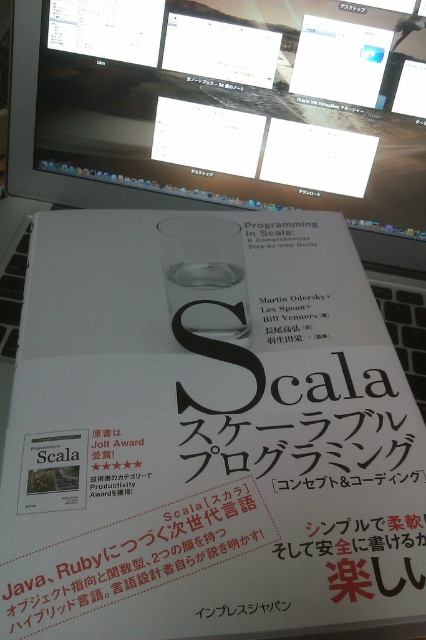
Is transparent glass cup at center smaller than black plastic keyboard at lower left?

Correct, transparent glass cup at center occupies less space than black plastic keyboard at lower left.

Which is in front, point (226, 282) or point (14, 356)?

Positioned in front is point (226, 282).

Find the location of a particular element. This screenshot has height=640, width=426. transparent glass cup at center is located at coordinates 204,273.

Is black paper at center further to the viewer compared to black plastic keyboard at lower left?

No.

Between black paper at center and black plastic keyboard at lower left, which one is positioned lower?

black paper at center is lower down.

The height and width of the screenshot is (640, 426). In order to click on black paper at center in this screenshot , I will do `click(294, 317)`.

Based on the photo, is matte black monitor at upper center below black plastic keyboard at lower left?

Incorrect, matte black monitor at upper center is not positioned below black plastic keyboard at lower left.

Is matte black monitor at upper center to the left of black plastic keyboard at lower left from the viewer's perspective?

No, matte black monitor at upper center is not to the left of black plastic keyboard at lower left.

Does point (218, 13) come farther from viewer compared to point (5, 269)?

Yes, it is behind point (5, 269).

This screenshot has height=640, width=426. What are the coordinates of `matte black monitor at upper center` in the screenshot? It's located at (230, 109).